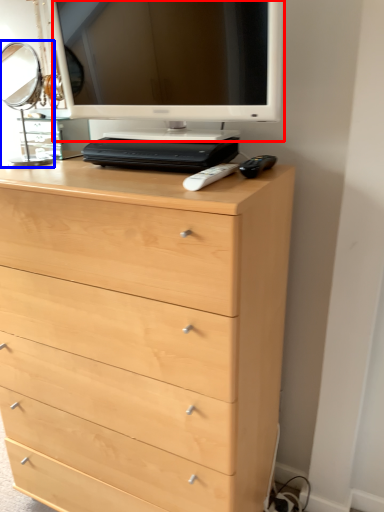
Question: Which object is closer to the camera taking this photo, computer monitor (highlighted by a red box) or table lamp (highlighted by a blue box)?

Choices:
 (A) computer monitor
 (B) table lamp

Answer: (A)